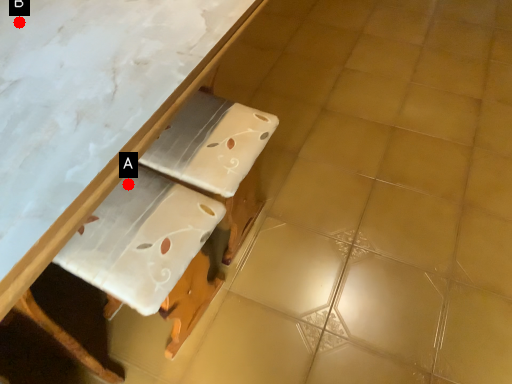
Question: Two points are circled on the image, labeled by A and B beside each circle. Which point is further to the camera?

Choices:
 (A) A is further
 (B) B is further

Answer: (A)